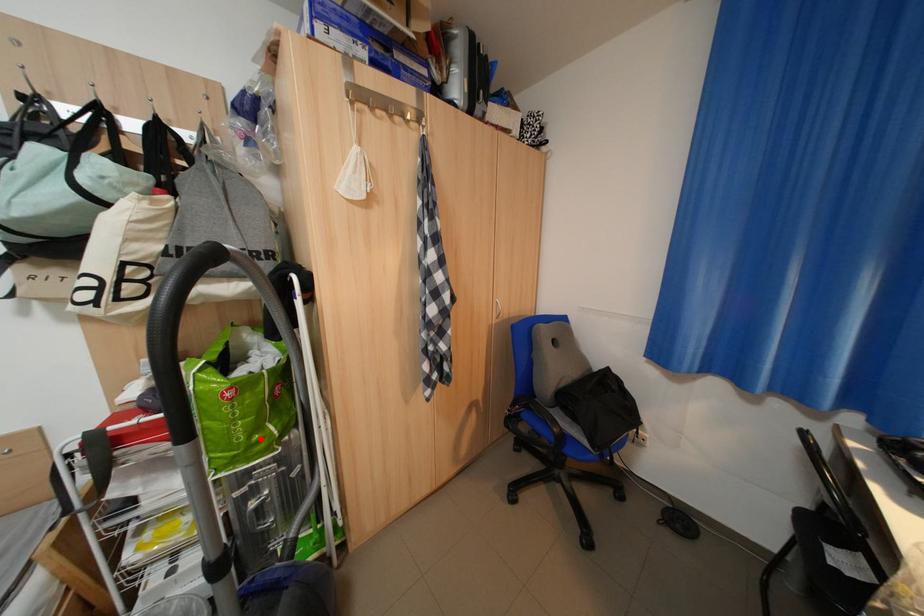
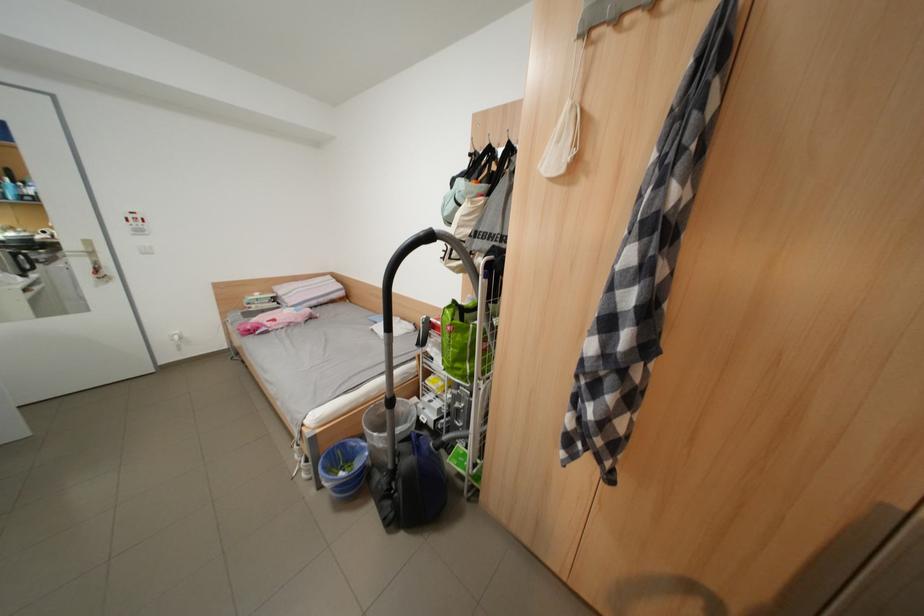
Where in the second image is the point corresponding to the highlighted location from the first image?

(466, 363)